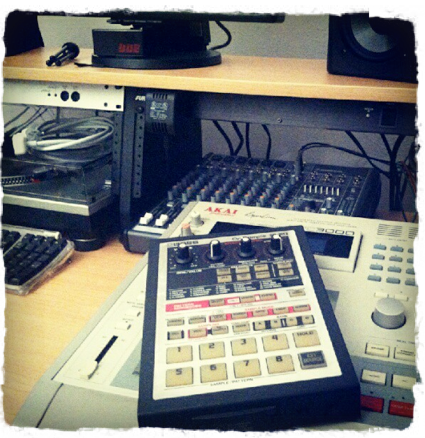
This screenshot has width=425, height=438. I want to click on silver knob, so click(x=388, y=311).